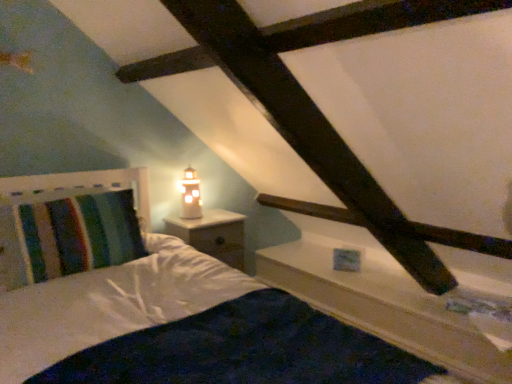
Image resolution: width=512 pixels, height=384 pixels. What are the coordinates of `free space in front of matte glass table lamp at upper center` in the screenshot? It's located at (189, 226).